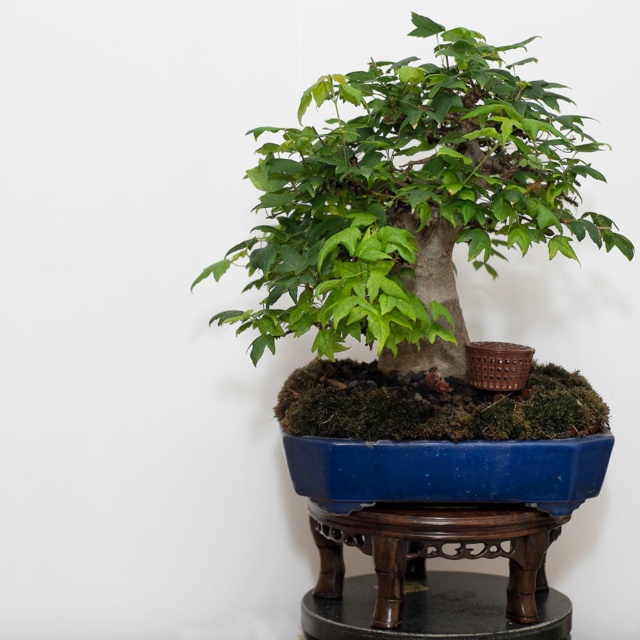
Question: Can you confirm if green matte bonsai tree at center is positioned below wooden stand at center?

Choices:
 (A) no
 (B) yes

Answer: (A)

Question: Is green matte bonsai tree at center to the left of wooden stand at center from the viewer's perspective?

Choices:
 (A) yes
 (B) no

Answer: (A)

Question: Can you confirm if green matte bonsai tree at center is positioned to the left of wooden stand at center?

Choices:
 (A) no
 (B) yes

Answer: (B)

Question: Among these points, which one is farthest from the camera?

Choices:
 (A) (474, 525)
 (B) (483, 236)

Answer: (A)

Question: Which point is closer to the camera taking this photo?

Choices:
 (A) (346, 218)
 (B) (490, 620)

Answer: (A)